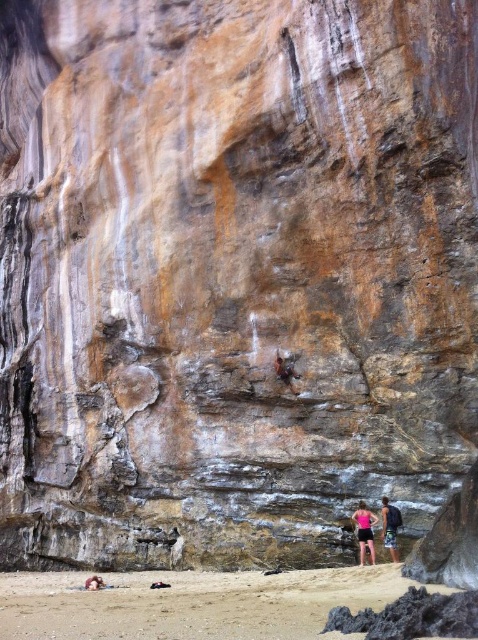
Between pink matte shorts at lower center and rusty metal rock climber at center, which one appears on the right side from the viewer's perspective?

Positioned to the right is pink matte shorts at lower center.

Does pink matte shorts at lower center have a smaller size compared to rusty metal rock climber at center?

Indeed, pink matte shorts at lower center has a smaller size compared to rusty metal rock climber at center.

Between point (357, 531) and point (296, 376), which one is positioned behind?

The point (296, 376) is more distant.

At what (x,y) coordinates should I click in order to perform the action: click on pink matte shorts at lower center. Please return your answer as a coordinate pair (x, y). Looking at the image, I should click on (365, 531).

Consider the image. Who is positioned more to the left, sandy beach at lower center or pink matte shorts at lower center?

From the viewer's perspective, sandy beach at lower center appears more on the left side.

Does sandy beach at lower center have a lesser width compared to pink matte shorts at lower center?

No, sandy beach at lower center is not thinner than pink matte shorts at lower center.

Is point (56, 636) farther from camera compared to point (371, 552)?

No, (56, 636) is closer to viewer.

What are the coordinates of `sandy beach at lower center` in the screenshot? It's located at (191, 604).

Which is more to the left, sandy beach at lower center or rusty metal rock climber at center?

sandy beach at lower center

Does sandy beach at lower center appear on the left side of rusty metal rock climber at center?

Indeed, sandy beach at lower center is positioned on the left side of rusty metal rock climber at center.

Who is more forward, (x=53, y=589) or (x=283, y=374)?

Positioned in front is point (x=283, y=374).

At what (x,y) coordinates should I click in order to perform the action: click on sandy beach at lower center. Please return your answer as a coordinate pair (x, y). This screenshot has height=640, width=478. Looking at the image, I should click on (191, 604).